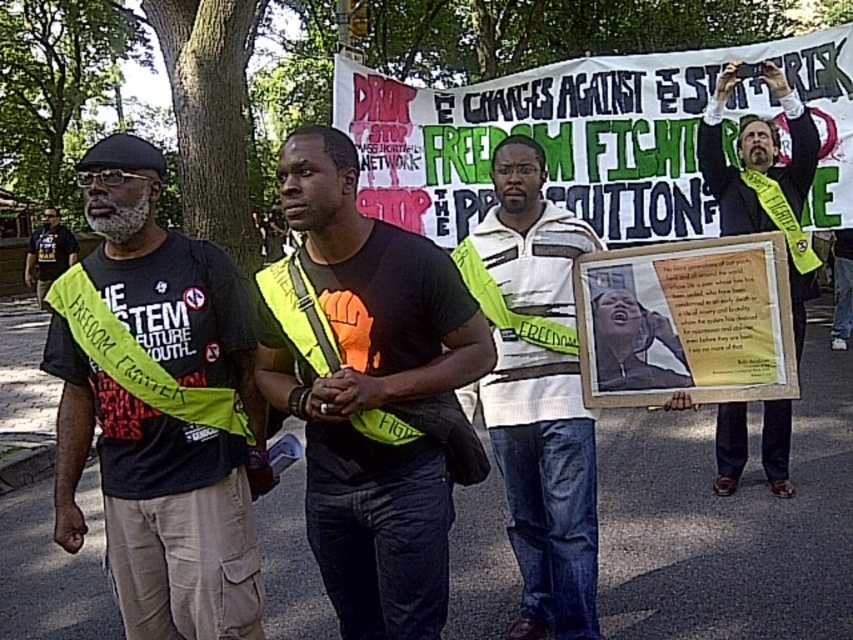
Question: Which point appears closest to the camera in this image?

Choices:
 (A) (398, 420)
 (B) (520, 566)
 (C) (180, 339)

Answer: (A)

Question: Is yellow fabric sash at right bigger than yellow reflective safety vest at center?

Choices:
 (A) yes
 (B) no

Answer: (A)

Question: Which of the following is the farthest from the observer?

Choices:
 (A) (404, 413)
 (B) (315, 492)
 (C) (33, 266)
 (D) (799, 128)

Answer: (C)

Question: In this image, where is neon yellow sash at left located relative to matte black t-shirt at left?

Choices:
 (A) right
 (B) left

Answer: (A)

Question: Does black fabric t-shirt at center appear on the right side of matte black t-shirt at left?

Choices:
 (A) yes
 (B) no

Answer: (A)

Question: Among these objects, which one is farthest from the camera?

Choices:
 (A) yellow fabric sash at right
 (B) yellow reflective safety vest at center
 (C) neon yellow sash at left
 (D) matte black t-shirt at left

Answer: (D)